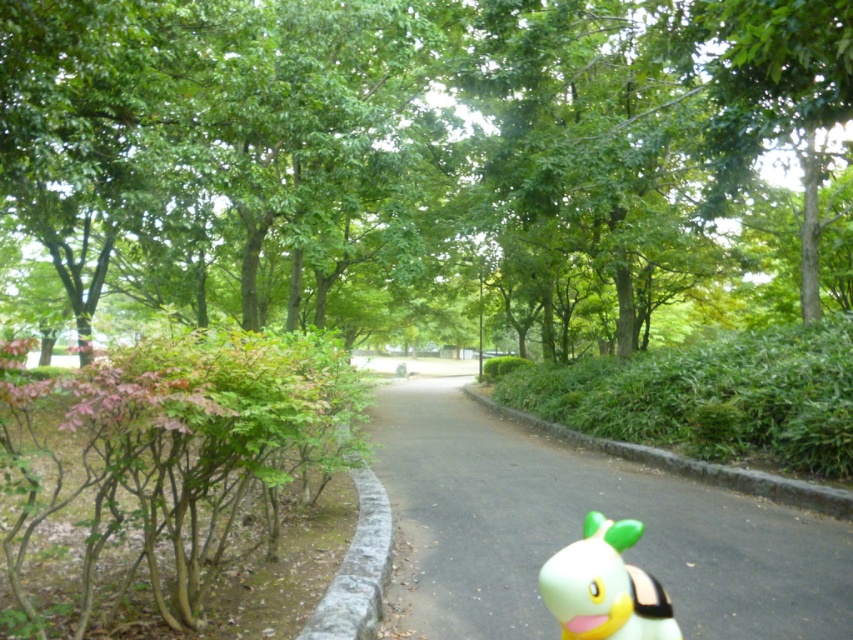
You are a gardener standing at the camera position in the park scene. You need to water the green leafy tree at center. If your watering can has a range of 3 meters, will you be able to reach the tree without moving closer?

The distance between the green leafy tree at center and the camera is 2.90 meters, which is within the watering can range of 3 meters. Therefore, you can reach the tree without moving closer.

Consider the image. You are a small bird flying over the park and want to land on one of the objects. Which object, the green leafy tree at center or the yellow rubber duck at lower right, is taller and would allow you to perch comfortably?

The green leafy tree at center is taller than the yellow rubber duck at lower right, so it would be the better option for perching comfortably.

You are a gardener planning to plant a new flower bed along the black asphalt path at center. Considering the green leafy tree at center, where should you place the flowers to avoid shading from the tree?

The green leafy tree at center is positioned over the black asphalt path at center, so planting the flowers on the side of the path opposite to the tree would avoid shading.